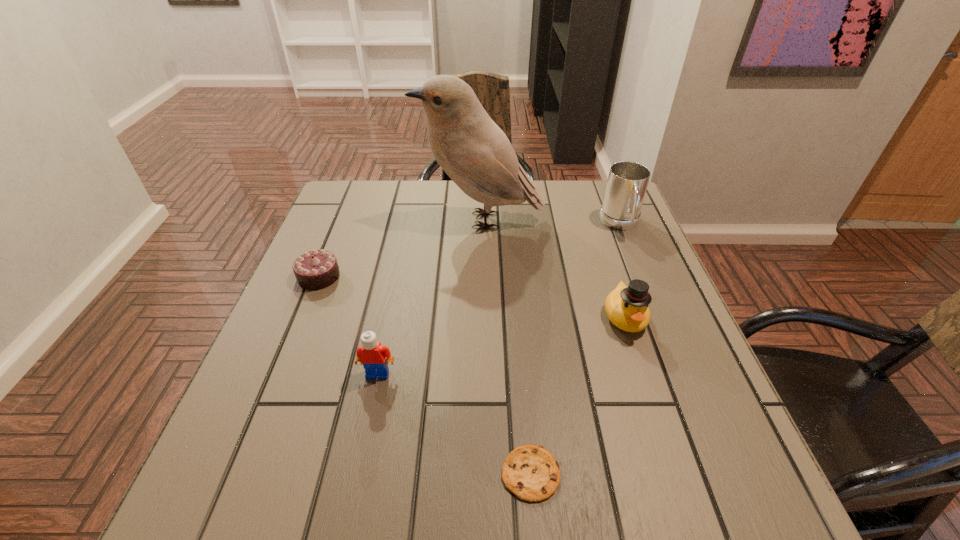
Find the location of a particular element. The height and width of the screenshot is (540, 960). mug present at the right edge is located at coordinates (627, 182).

You are a GUI agent. You are given a task and a screenshot of the screen. Output one action in this format:
    pyautogui.click(x=<x>, y=<y>)
    Task: Click on the duck that is at the right edge
    
    Given the screenshot: What is the action you would take?
    pyautogui.click(x=627, y=308)

Image resolution: width=960 pixels, height=540 pixels. I want to click on object situated at the far right corner, so click(627, 182).

Locate an element on the screen. This screenshot has height=540, width=960. vacant point at the far edge is located at coordinates (430, 211).

Find the location of `free spot at the near edge of the desktop`. free spot at the near edge of the desktop is located at coordinates (394, 508).

The width and height of the screenshot is (960, 540). I want to click on vacant area at the left edge of the desktop, so click(x=264, y=448).

Image resolution: width=960 pixels, height=540 pixels. What are the coordinates of `vacant position at the right edge of the desktop` in the screenshot? It's located at [x=673, y=382].

Locate an element on the screen. This screenshot has width=960, height=540. vacant space at the near left corner of the desktop is located at coordinates (196, 519).

Where is `free space between the second tallest object and the fifth tallest object`? free space between the second tallest object and the fifth tallest object is located at coordinates (469, 250).

Find the location of a particular element. empty space between the duck and the fifth farthest object is located at coordinates (501, 345).